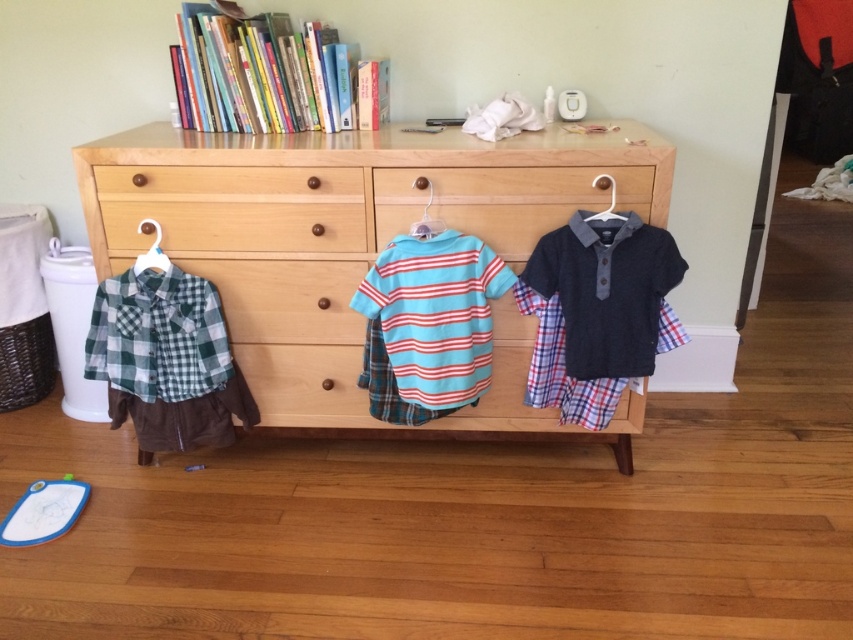
Question: From the image, what is the correct spatial relationship of dark blue textured polo shirt at center in relation to plaid cotton shirt at center?

Choices:
 (A) left
 (B) right

Answer: (B)

Question: Does dark blue textured polo shirt at center have a smaller size compared to white plastic hanger at center?

Choices:
 (A) no
 (B) yes

Answer: (A)

Question: Which point appears closest to the camera in this image?

Choices:
 (A) (575, 266)
 (B) (431, 196)

Answer: (A)

Question: Which is farther from the dark blue textured polo shirt at center?

Choices:
 (A) metallic silver hanger at center
 (B) white plastic hanger at left
 (C) green plaid shirt at left

Answer: (B)

Question: Which of the following is the farthest from the observer?

Choices:
 (A) dark blue textured polo shirt at center
 (B) metallic silver hanger at center

Answer: (B)

Question: Is striped cotton shirt at center further to the viewer compared to plaid cotton shirt at center?

Choices:
 (A) yes
 (B) no

Answer: (B)